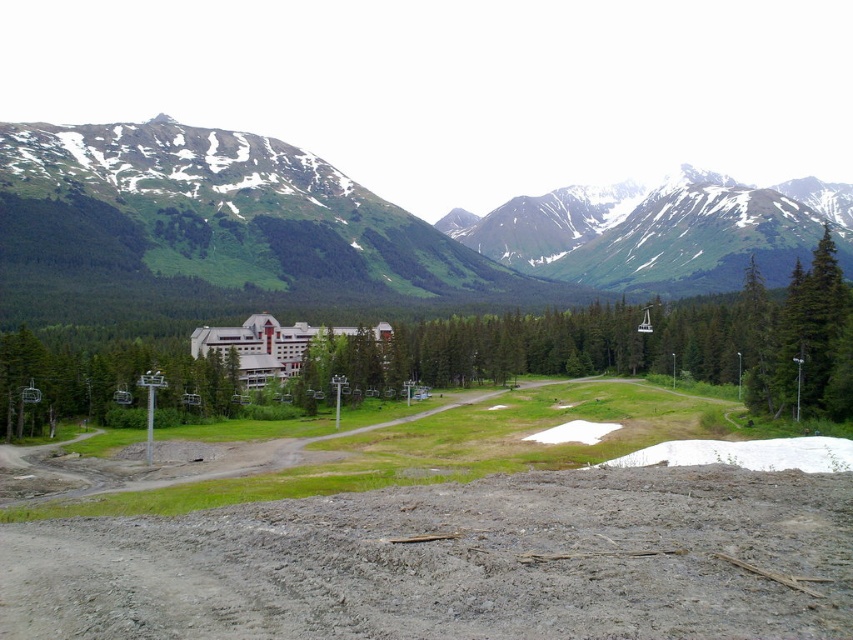
Question: Does brown sandy dirt track at lower center have a greater width compared to white matte hotel at center?

Choices:
 (A) no
 (B) yes

Answer: (A)

Question: Which object is farther from the camera taking this photo?

Choices:
 (A) green matte tree at center
 (B) green grassy mountain at center
 (C) brown sandy dirt track at lower center
 (D) snowy granite mountain at upper center

Answer: (D)

Question: Can you confirm if green grassy mountain at center is wider than snowy granite mountain at upper center?

Choices:
 (A) no
 (B) yes

Answer: (B)

Question: Which of these objects is positioned closest to the white matte hotel at center?

Choices:
 (A) brown sandy dirt track at lower center
 (B) green matte tree at center
 (C) green grassy mountain at center

Answer: (B)

Question: Which object is positioned closest to the green grassy mountain at center?

Choices:
 (A) brown sandy dirt track at lower center
 (B) white matte hotel at center
 (C) snowy granite mountain at upper center

Answer: (C)

Question: Does green grassy mountain at center appear on the left side of white matte hotel at center?

Choices:
 (A) no
 (B) yes

Answer: (A)